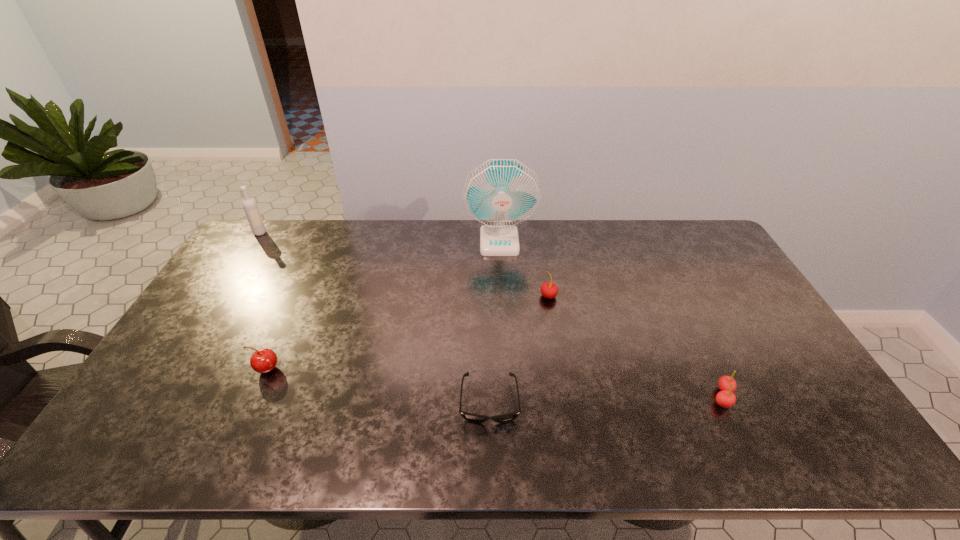
The image size is (960, 540). I want to click on object at the far left corner, so click(x=250, y=207).

Find the location of a particular element. This screenshot has width=960, height=540. free location at the far edge is located at coordinates (544, 258).

Image resolution: width=960 pixels, height=540 pixels. Find the location of `blank space at the near edge`. blank space at the near edge is located at coordinates (453, 449).

In the image, there is a desktop. Identify the location of free space at the left edge. (255, 261).

The width and height of the screenshot is (960, 540). Find the location of `vacant area at the right edge of the desktop`. vacant area at the right edge of the desktop is located at coordinates (780, 394).

Find the location of a particular element. free region at the far left corner is located at coordinates (261, 244).

What are the coordinates of `free space at the far right corner` in the screenshot? It's located at (680, 227).

Where is `unoccupied position between the second nearest cherry and the farthest cherry`? unoccupied position between the second nearest cherry and the farthest cherry is located at coordinates (407, 333).

I want to click on free space that is in between the sunglasses and the second cherry from right to left, so click(519, 349).

You are a GUI agent. You are given a task and a screenshot of the screen. Output one action in this format:
    pyautogui.click(x=<x>, y=<y>)
    Task: Click on the free space between the second tallest object and the sunglasses
    
    Given the screenshot: What is the action you would take?
    pyautogui.click(x=374, y=317)